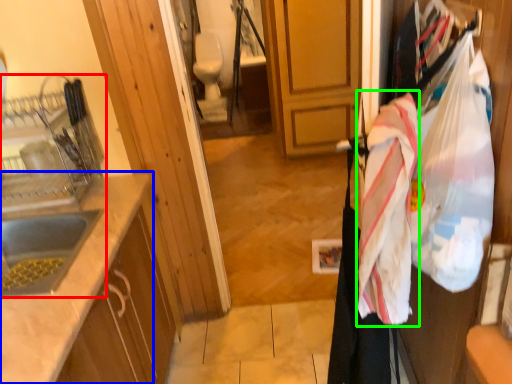
Question: Which object is positioned farthest from sink (highlighted by a red box)? Select from countertop (highlighted by a blue box) and blanket (highlighted by a green box).

Choices:
 (A) countertop
 (B) blanket

Answer: (B)